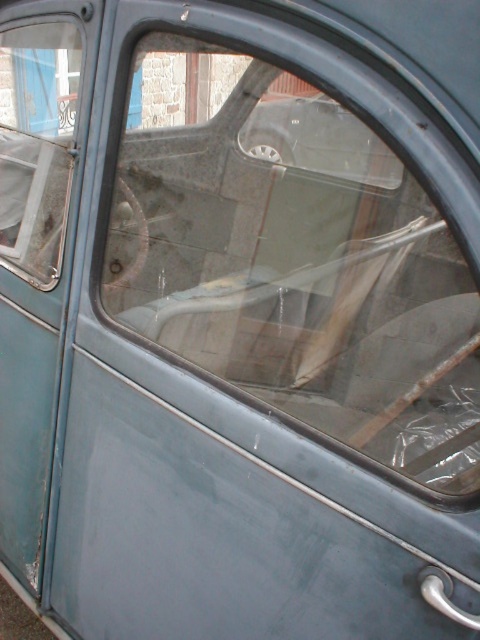
Does transparent plastic windshield at center have a greater height compared to transparent plastic window at upper left?

Correct, transparent plastic windshield at center is much taller as transparent plastic window at upper left.

Is transparent plastic windshield at center shorter than transparent plastic window at upper left?

No.

Which is in front, point (296, 234) or point (37, 259)?

Point (296, 234)

Identify the location of transparent plastic windshield at center. [294, 259].